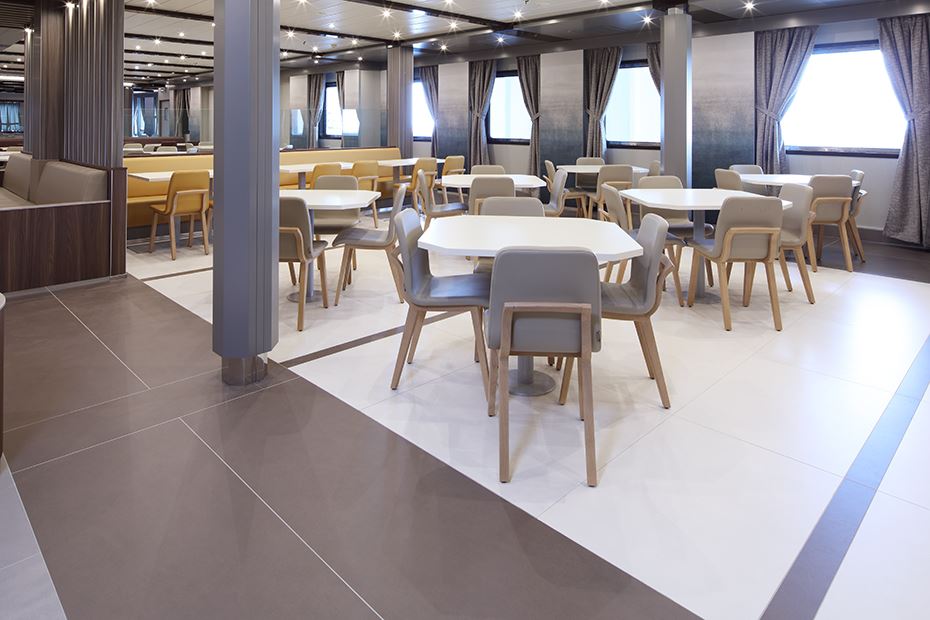
Where is `windows`? This screenshot has height=620, width=930. windows is located at coordinates (811, 118), (634, 105), (503, 108), (418, 118), (331, 118).